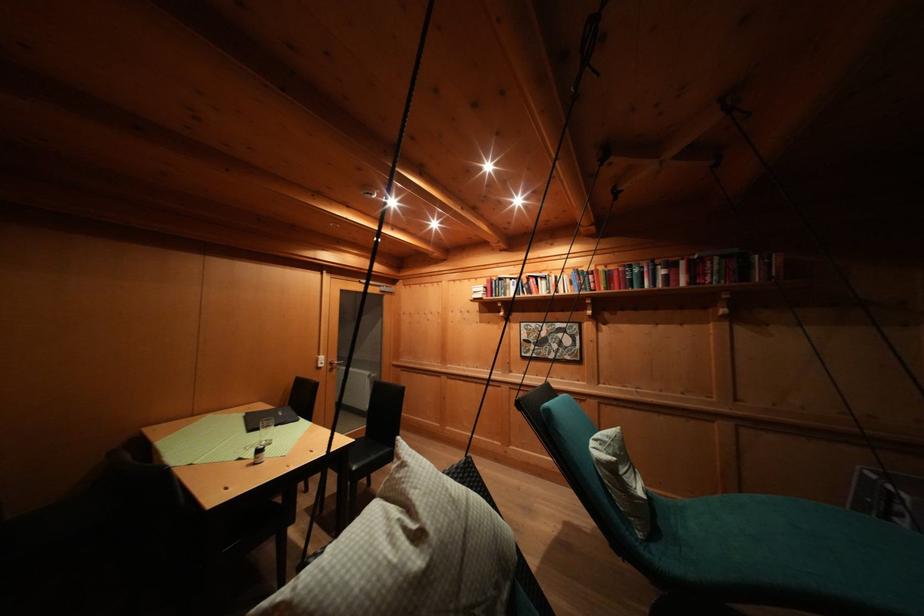
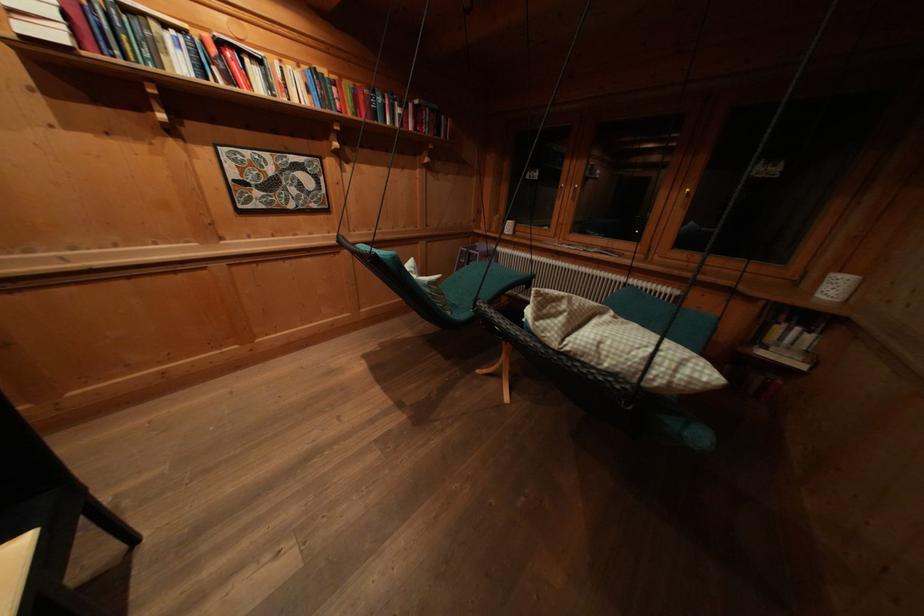
Find the pixel in the second image that matches the point at 535,282 in the first image.

(225, 47)